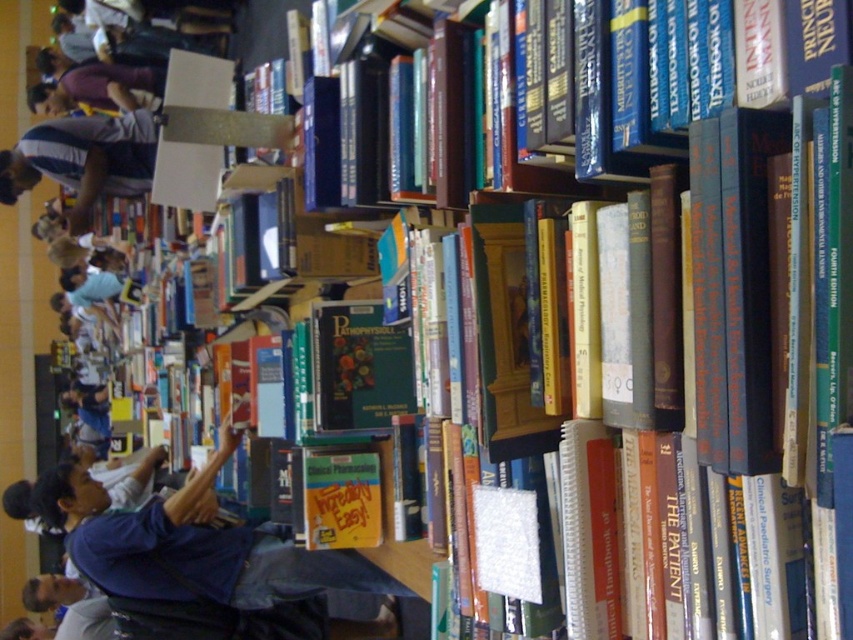
Consider the image. You are a store employee who needs to move a 1.5 meter long ladder from the blue fabric jacket at lower left to the gray striped shirt at left. Can you move the ladder horizontally between them without tilting it?

The distance between the blue fabric jacket at lower left and the gray striped shirt at left is 1.54 meters, so the ladder can be moved horizontally between them since it is slightly longer than the distance between them.

You are a customer in the bookstore and you want to grab a jacket and a shirt. Which one is taller between the blue fabric jacket at lower left and the gray striped shirt at left?

The blue fabric jacket at lower left is taller than the gray striped shirt at left.